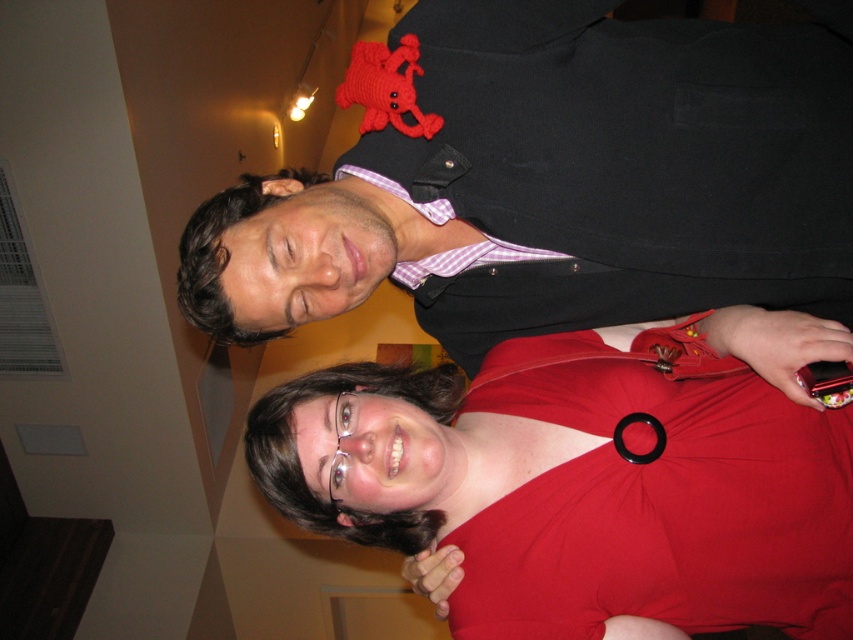
Which is in front, point (486, 54) or point (772, 602)?

Point (486, 54) is in front.

Is matte black vest at upper center positioned behind red matte dress at lower center?

No, it is in front of red matte dress at lower center.

Who is more distant from viewer, (415, 260) or (598, 524)?

Positioned behind is point (415, 260).

You are a GUI agent. You are given a task and a screenshot of the screen. Output one action in this format:
    pyautogui.click(x=<x>, y=<y>)
    Task: Click on the matte black vest at upper center
    
    Given the screenshot: What is the action you would take?
    [x=554, y=180]